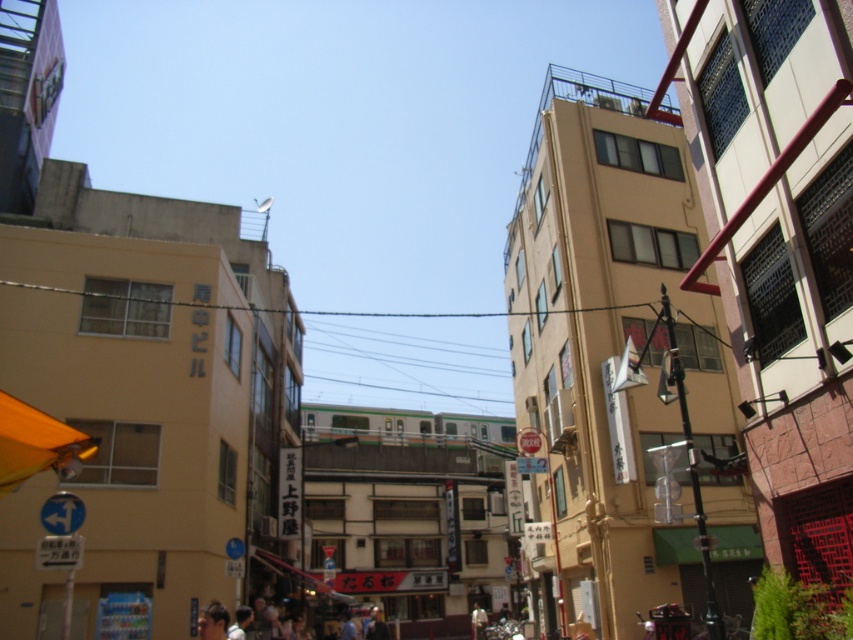
Is clear wire at center to the right of smooth skin face at lower center from the viewer's perspective?

Incorrect, clear wire at center is not on the right side of smooth skin face at lower center.

Is point (357, 316) less distant than point (210, 616)?

That is False.

You are a GUI agent. You are given a task and a screenshot of the screen. Output one action in this format:
    pyautogui.click(x=<x>, y=<y>)
    Task: Click on the clear wire at center
    
    Given the screenshot: What is the action you would take?
    pyautogui.click(x=109, y=294)

Who is lower down, matte black crowd at center or smooth skin face at lower center?

matte black crowd at center is below.

Is point (231, 636) farther from viewer compared to point (218, 632)?

That is False.

Locate an element on the screen. This screenshot has width=853, height=640. matte black crowd at center is located at coordinates (358, 625).

Does clear wire at center have a greater width compared to matte black crowd at center?

Yes.

Does clear wire at center have a larger size compared to matte black crowd at center?

Indeed, clear wire at center has a larger size compared to matte black crowd at center.

The width and height of the screenshot is (853, 640). What do you see at coordinates (109, 294) in the screenshot? I see `clear wire at center` at bounding box center [109, 294].

Where is `clear wire at center`? This screenshot has width=853, height=640. clear wire at center is located at coordinates (109, 294).